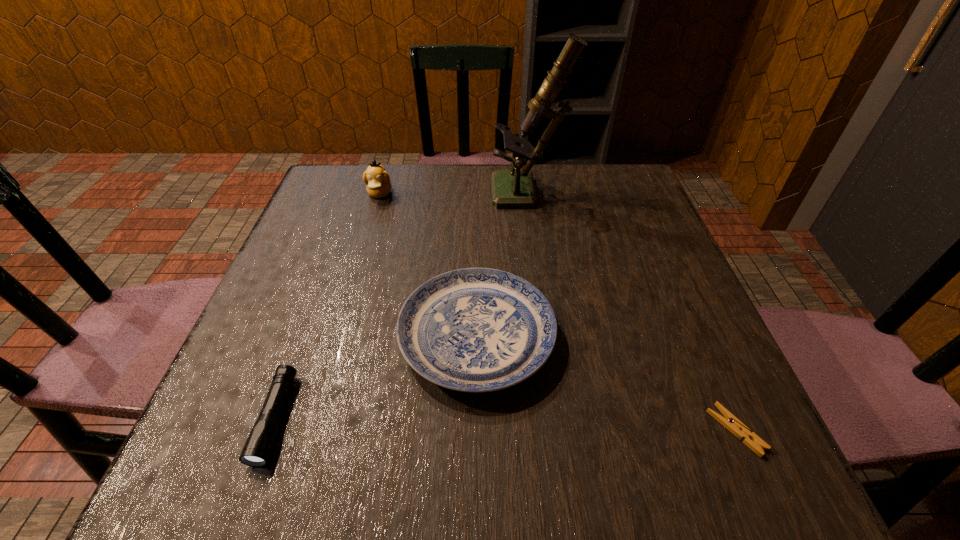
This screenshot has width=960, height=540. What are the coordinates of `object present at the far left corner` in the screenshot? It's located at (377, 179).

Find the location of a particular element. object situated at the near left corner is located at coordinates (257, 449).

Identify the location of object located at the near right corner. (729, 421).

Find the location of a particular element. This screenshot has width=960, height=540. vacant area at the far edge of the desktop is located at coordinates (551, 184).

Find the location of a particular element. The height and width of the screenshot is (540, 960). vacant space at the near edge of the desktop is located at coordinates (402, 485).

In order to click on vacant space at the left edge of the desktop in this screenshot , I will do `click(349, 240)`.

Image resolution: width=960 pixels, height=540 pixels. I want to click on free space at the right edge of the desktop, so click(x=704, y=364).

Image resolution: width=960 pixels, height=540 pixels. I want to click on vacant area at the far left corner, so click(334, 214).

In the image, there is a desktop. Identify the location of vacant area at the near left corner. The width and height of the screenshot is (960, 540). (285, 458).

Where is `vacant area at the far right corner of the desktop`? vacant area at the far right corner of the desktop is located at coordinates (597, 202).